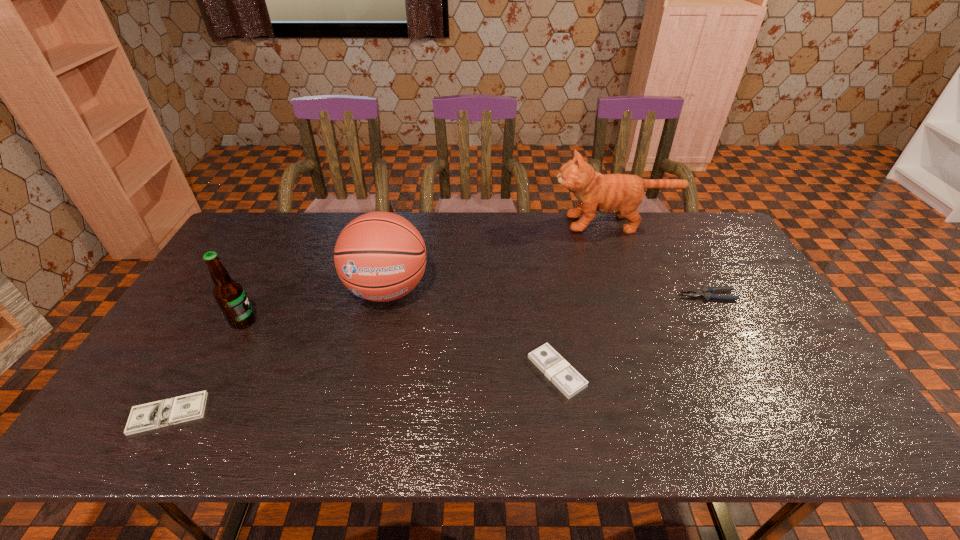
At what (x,y) coordinates should I click in order to perform the action: click on free space at the far left corner of the desktop. Please return your answer as a coordinate pair (x, y). The height and width of the screenshot is (540, 960). Looking at the image, I should click on (281, 219).

Where is `free point at the far right corner`? The width and height of the screenshot is (960, 540). free point at the far right corner is located at coordinates click(675, 220).

Locate an element on the screen. free space that is in between the beer bottle and the shortest object is located at coordinates (205, 367).

Find the location of a particular element. This screenshot has height=540, width=960. free spot between the beer bottle and the farthest object is located at coordinates (428, 272).

Where is `free area in between the beer bottle and the shorter dollar`? Image resolution: width=960 pixels, height=540 pixels. free area in between the beer bottle and the shorter dollar is located at coordinates click(205, 367).

Locate an element on the screen. The height and width of the screenshot is (540, 960). free space between the fifth tallest object and the farthest object is located at coordinates (585, 298).

Image resolution: width=960 pixels, height=540 pixels. Find the location of `unoccupied area between the cat and the beer bottle`. unoccupied area between the cat and the beer bottle is located at coordinates (428, 272).

At what (x,y) coordinates should I click in order to perform the action: click on free space between the pliers and the shorter dollar. Please return your answer as a coordinate pair (x, y). The width and height of the screenshot is (960, 540). Looking at the image, I should click on (439, 354).

Find the location of a particular element. The width and height of the screenshot is (960, 540). free space between the shorter dollar and the second shortest object is located at coordinates (363, 393).

At what (x,y) coordinates should I click in order to perform the action: click on vacant space in between the basketball and the beer bottle. Please return your answer as a coordinate pair (x, y). The width and height of the screenshot is (960, 540). Looking at the image, I should click on (315, 305).